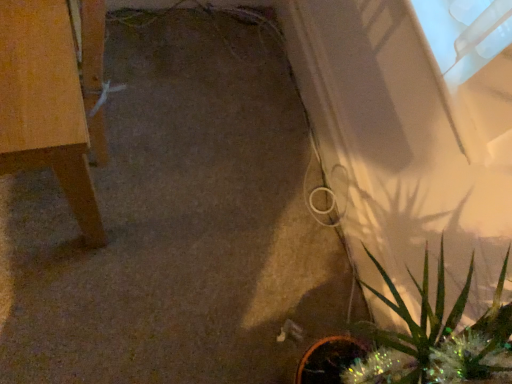
I want to click on free space behind light brown wood table at left, so click(193, 63).